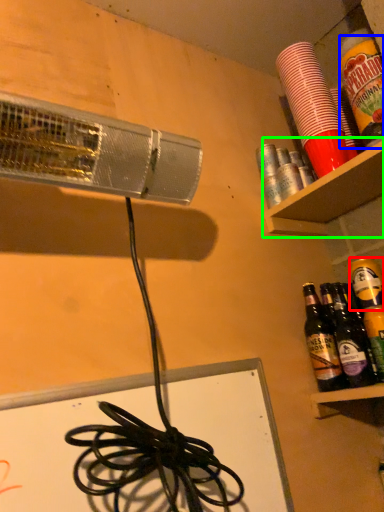
Question: Based on their relative distances, which object is nearer to beer (highlighted by a red box)? Choose from beverage (highlighted by a blue box) and shelf (highlighted by a green box).

Choices:
 (A) beverage
 (B) shelf

Answer: (B)